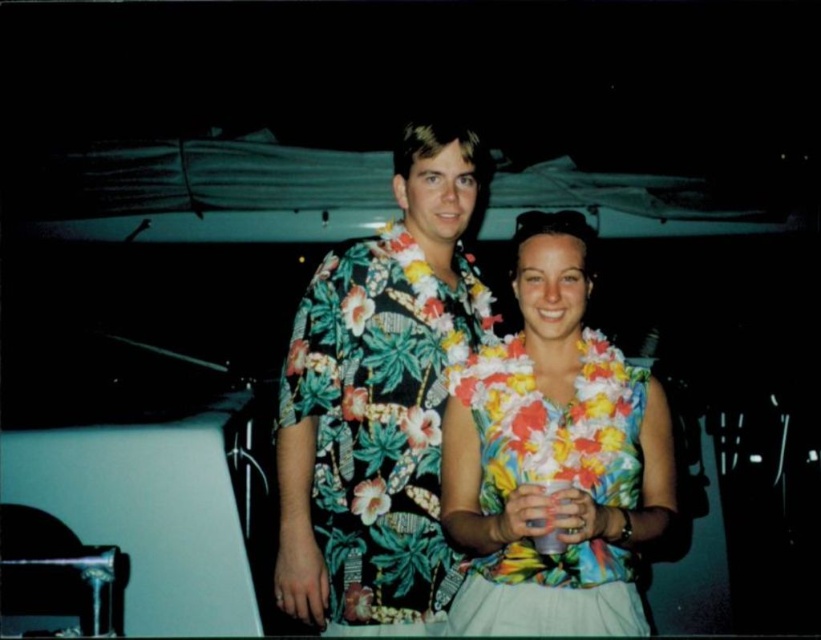
Question: Which object is positioned closest to the floral fabric lei at center?

Choices:
 (A) translucent plastic cup at center
 (B) floral print shirt at center

Answer: (A)

Question: Is floral print shirt at center wider than floral fabric lei at center?

Choices:
 (A) no
 (B) yes

Answer: (B)

Question: Does floral fabric lei at center have a smaller size compared to translucent plastic cup at center?

Choices:
 (A) no
 (B) yes

Answer: (A)

Question: Does floral fabric lei at center appear on the left side of translucent plastic cup at center?

Choices:
 (A) yes
 (B) no

Answer: (B)

Question: Which object is closer to the camera taking this photo?

Choices:
 (A) translucent plastic cup at center
 (B) floral fabric lei at center

Answer: (B)

Question: Which point is farther to the camera?

Choices:
 (A) (540, 536)
 (B) (621, 568)

Answer: (B)